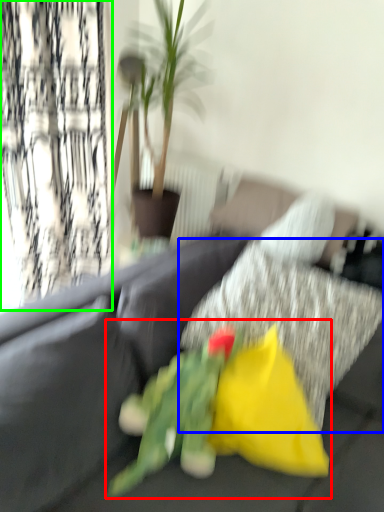
Question: Considering the real-world distances, which object is farthest from floral arrangement (highlighted by a red box)? pillow (highlighted by a blue box) or curtain (highlighted by a green box)?

Choices:
 (A) pillow
 (B) curtain

Answer: (B)